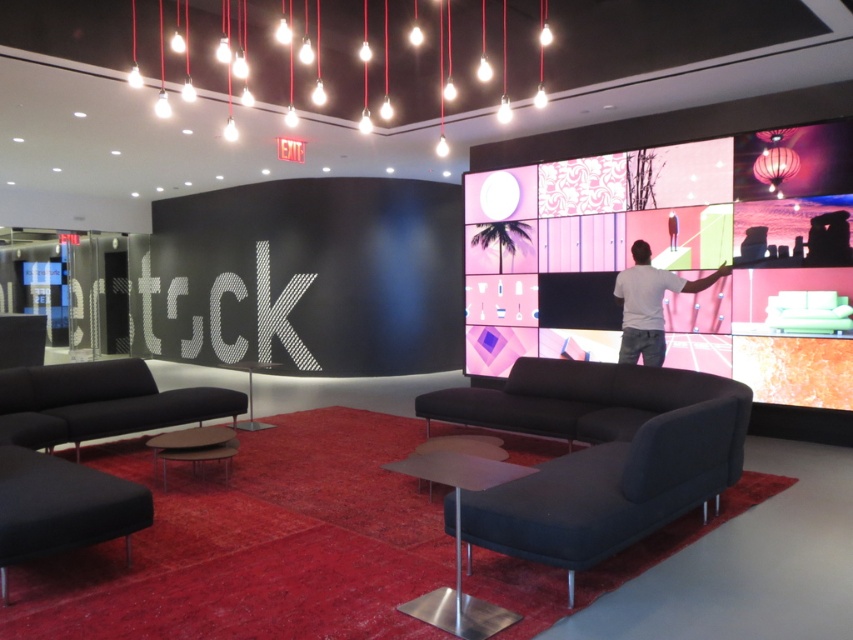
Is point (641, 301) closer to viewer compared to point (486, 451)?

That is False.

Between gray matte shirt at upper right and smooth leather stool at center, which one appears on the right side from the viewer's perspective?

gray matte shirt at upper right is more to the right.

Does point (706, 285) lie behind point (503, 454)?

Yes.

Where is `gray matte shirt at upper right`? The height and width of the screenshot is (640, 853). gray matte shirt at upper right is located at coordinates (648, 304).

Does black fabric couch at left appear under smooth leather stool at center?

No.

Who is positioned more to the right, black fabric couch at left or smooth leather stool at center?

smooth leather stool at center is more to the right.

Does point (86, 419) lie in front of point (505, 452)?

No.

Locate an element on the screen. This screenshot has width=853, height=640. black fabric couch at left is located at coordinates (99, 403).

Can you confirm if black fabric couch at left is shorter than gray matte shirt at upper right?

Yes, black fabric couch at left is shorter than gray matte shirt at upper right.

Which of these two, black fabric couch at left or gray matte shirt at upper right, stands shorter?

black fabric couch at left

Measure the distance between point (38, 401) and camera.

Point (38, 401) is 17.15 feet away from camera.

Locate an element on the screen. The image size is (853, 640). black fabric couch at left is located at coordinates (99, 403).